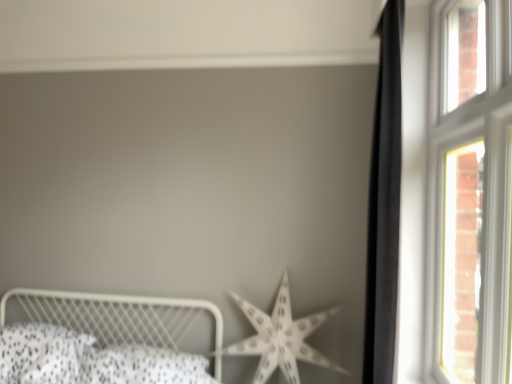
Question: Is white wooden window at right taller or shorter than black matte curtain at right?

Choices:
 (A) tall
 (B) short

Answer: (B)

Question: From the image's perspective, is white wooden window at right located above or below black matte curtain at right?

Choices:
 (A) below
 (B) above

Answer: (B)

Question: Estimate the real-world distances between objects in this image. Which object is farther from the white metal bed at lower left?

Choices:
 (A) white paper star at center
 (B) white wooden window at right
 (C) black matte curtain at right

Answer: (B)

Question: Based on their relative distances, which object is nearer to the white paper star at center?

Choices:
 (A) white wooden window at right
 (B) black matte curtain at right
 (C) white metal bed at lower left

Answer: (C)